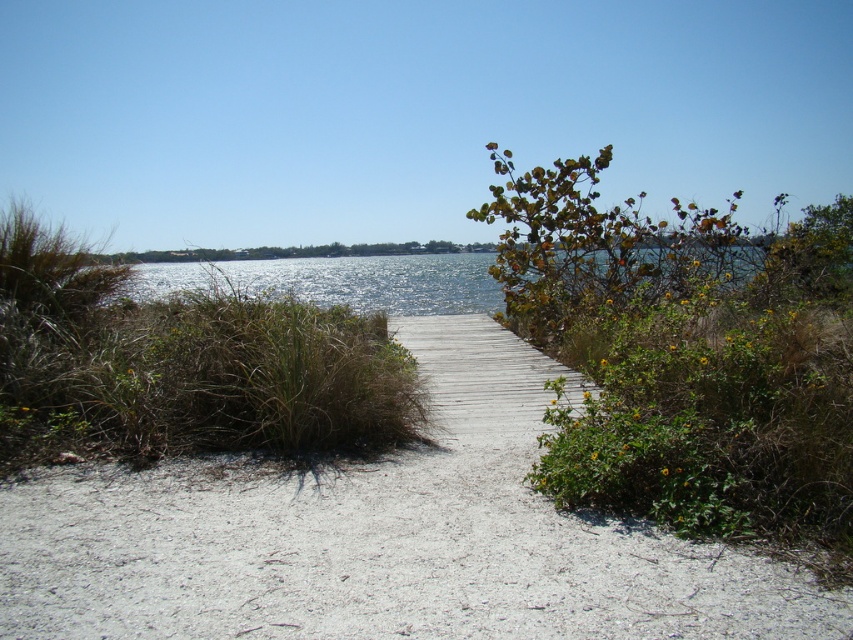
You are standing at the camera position and want to take a photo of the green leafy bush at upper right. If your camera has a maximum focus range of 3 meters, will you be able to capture the bush clearly?

The green leafy bush at upper right and camera are 3.30 meters apart. Since the distance is greater than the camera maximum focus range of 3 meters, you won not be able to capture the bush clearly.

Consider the image. You are standing at the point marked by the coordinates point (688, 356) in the image. Looking around, you see a green leafy bush at upper right. What direction should you face to see the wooden dock extending into the water?

Since the point (688, 356) is the green leafy bush at upper right, facing towards the opposite direction of the bush would allow you to see the wooden dock extending into the water. The dock is located in the lower part of the image, so facing downward from the bush would direct your view towards it.

You are a gardener planning to trim the green leafy bush at upper right and the green grass at center. Which of these two plants requires more effort to maintain due to its larger size?

The green leafy bush at upper right requires more effort to maintain because its width surpasses that of the green grass at center.